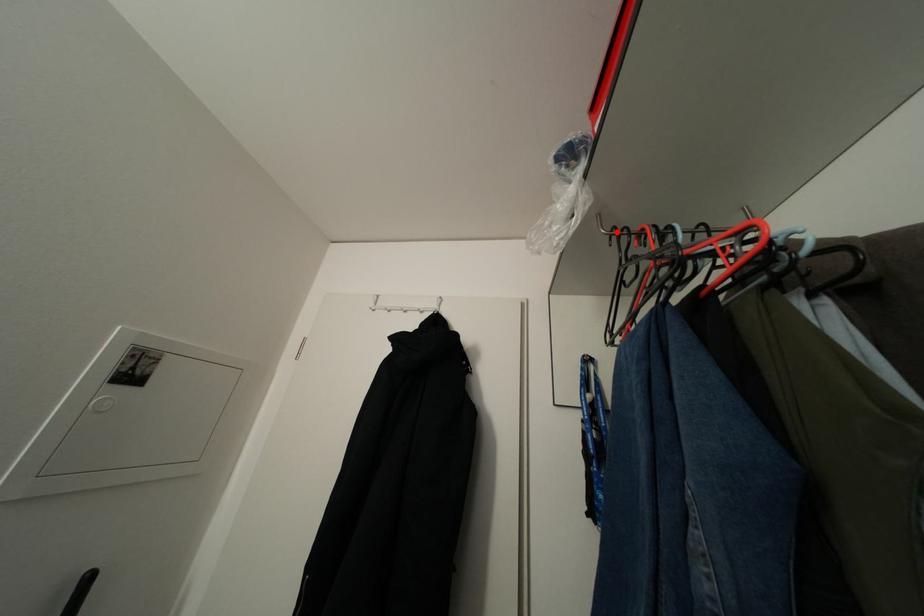
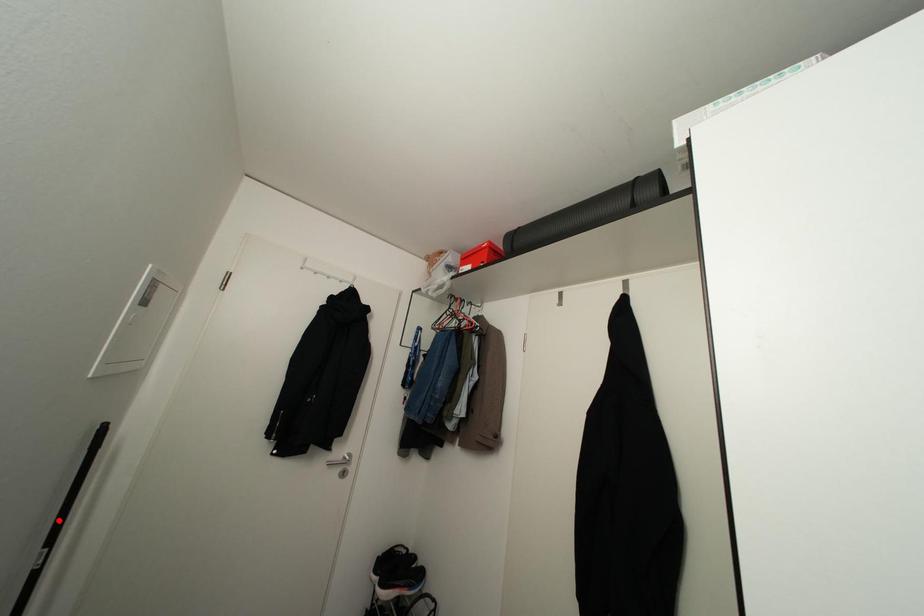
I am providing you with two images of the same scene from different viewpoints. A red point is marked on the first image and another point is marked on the second image. Are the points marked in image1 and image2 representing the same 3D position?

No